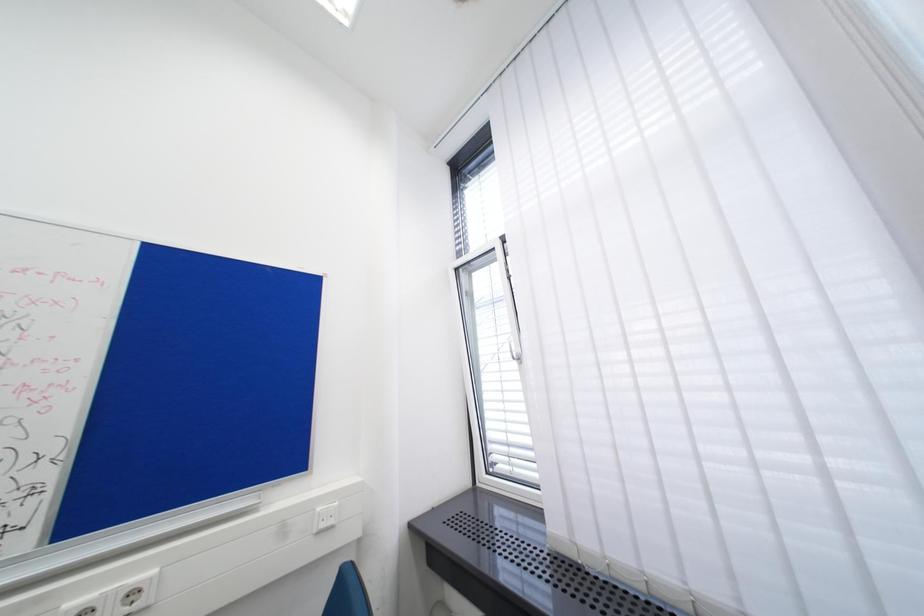
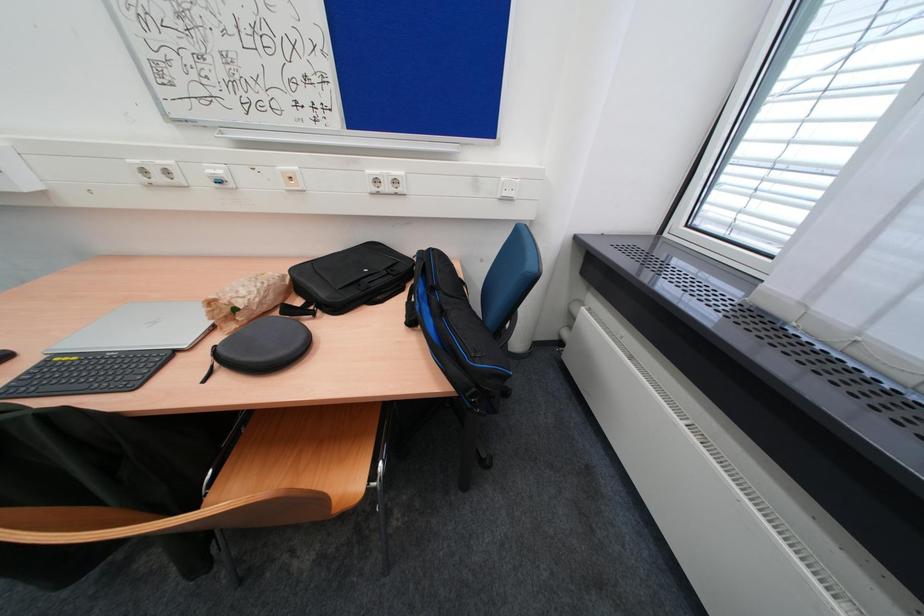
How did the camera likely rotate?

The rotation direction of the camera is left-down.